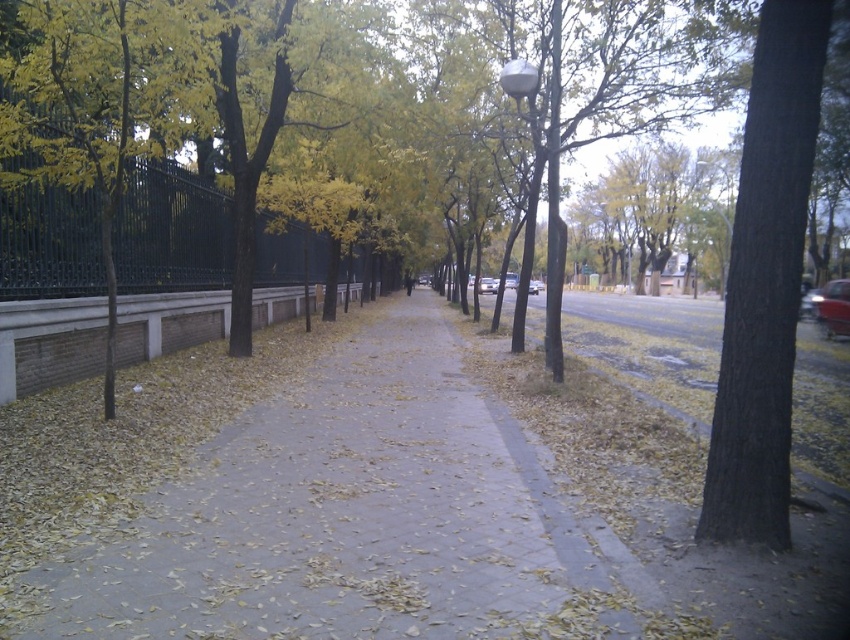
Does dark brown textured tree trunk at right have a smaller size compared to yellow-green leaves at left?

Actually, dark brown textured tree trunk at right might be larger than yellow-green leaves at left.

Is point (728, 342) positioned in front of point (99, 204)?

Yes, point (728, 342) is closer to viewer.

Where is `dark brown textured tree trunk at right`? dark brown textured tree trunk at right is located at coordinates (765, 282).